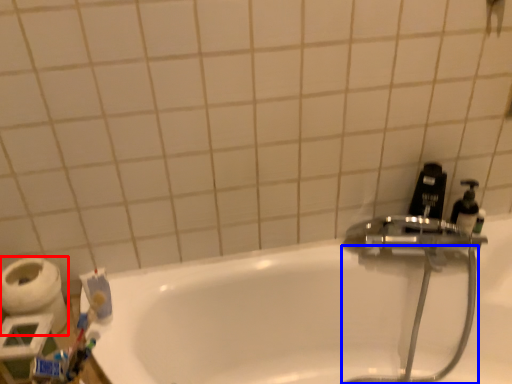
Question: Which object appears farthest to the camera in this image, toilet paper (highlighted by a red box) or garden hose (highlighted by a blue box)?

Choices:
 (A) toilet paper
 (B) garden hose

Answer: (A)